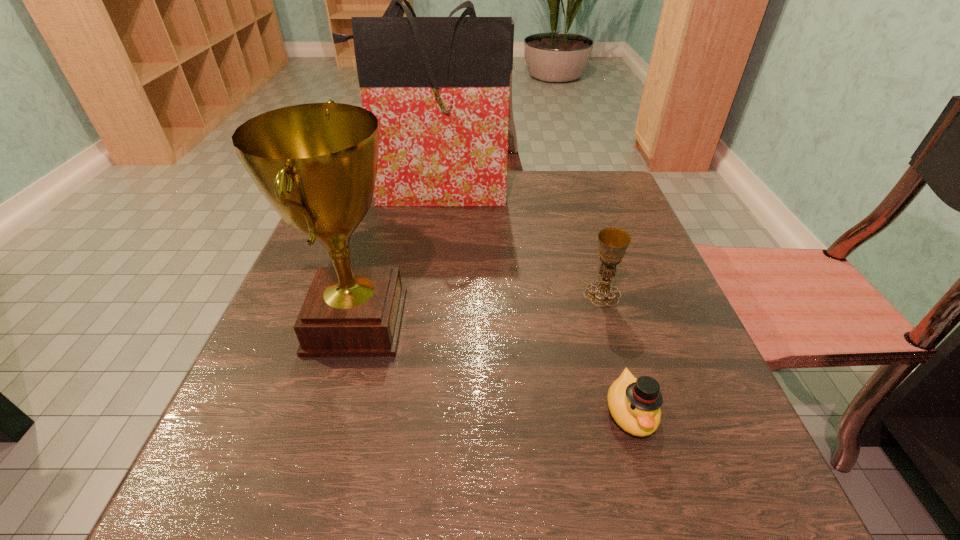
I want to click on the tallest object, so click(x=439, y=86).

Locate an element on the screen. Image resolution: width=960 pixels, height=540 pixels. the farthest object is located at coordinates (439, 86).

Locate an element on the screen. The image size is (960, 540). the third shortest object is located at coordinates (316, 164).

Identify the location of chalice. This screenshot has height=540, width=960. (613, 242).

Find the location of a particular element. The width and height of the screenshot is (960, 540). the shortest object is located at coordinates (634, 404).

Where is `free space located 0.090m on the front side of the shopping bag`? The width and height of the screenshot is (960, 540). free space located 0.090m on the front side of the shopping bag is located at coordinates click(427, 233).

This screenshot has width=960, height=540. Identify the location of vacant space located on the plaque of the award. (554, 322).

Find the location of `free space located 0.320m on the left of the chalice`. free space located 0.320m on the left of the chalice is located at coordinates 414,294.

The width and height of the screenshot is (960, 540). I want to click on vacant space located on the front-facing side of the duck, so click(x=656, y=500).

Locate an element on the screen. object at the far edge is located at coordinates (439, 86).